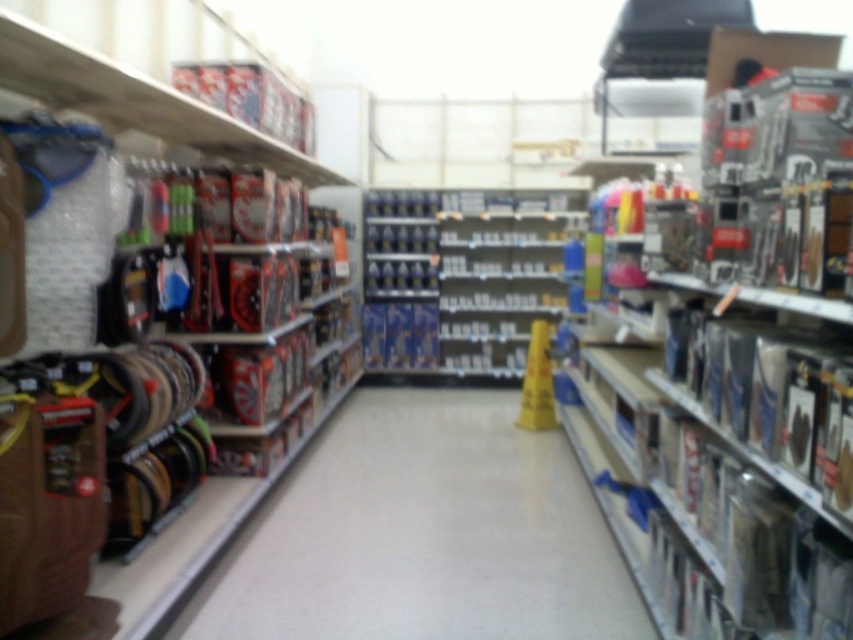
Question: Which of the following is the closest to the observer?

Choices:
 (A) (131, 113)
 (B) (350, 577)

Answer: (A)

Question: Can you confirm if smooth plastic aisle at center is positioned to the right of metallic silver tools at left?

Choices:
 (A) yes
 (B) no

Answer: (A)

Question: Can you confirm if smooth plastic aisle at center is positioned below metallic silver tools at left?

Choices:
 (A) yes
 (B) no

Answer: (A)

Question: Does smooth plastic aisle at center have a lesser width compared to metallic silver tools at left?

Choices:
 (A) yes
 (B) no

Answer: (B)